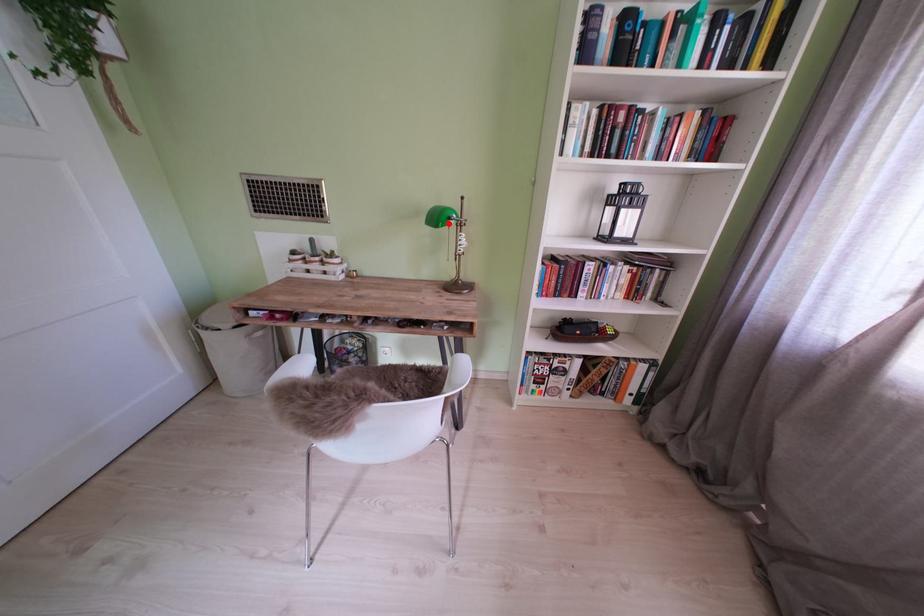
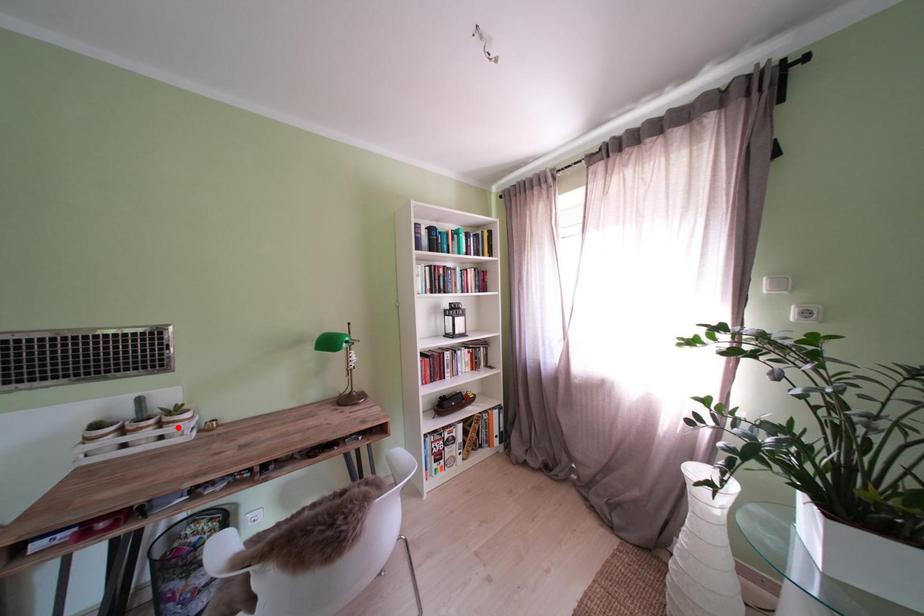
I am providing you with two images of the same scene from different viewpoints. A red point is marked on the first image and another point is marked on the second image. Does the point marked in image1 correspond to the same location as the one in image2?

No